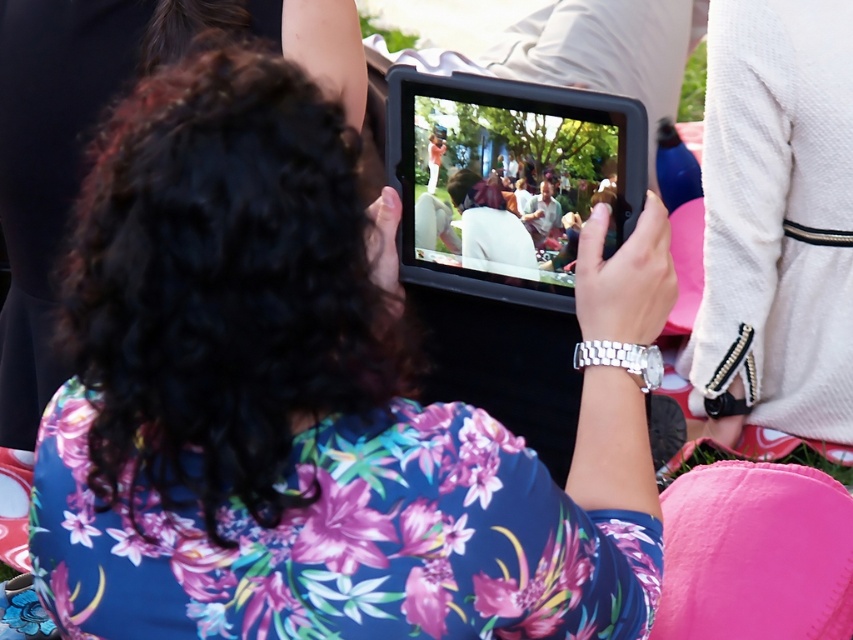
Does floral fabric shirt at center appear on the right side of black matte tablet at center?

In fact, floral fabric shirt at center is to the left of black matte tablet at center.

Is point (125, 337) behind point (416, 237)?

No.

The width and height of the screenshot is (853, 640). What do you see at coordinates (297, 408) in the screenshot?
I see `floral fabric shirt at center` at bounding box center [297, 408].

Find the location of `floral fabric shirt at center`. floral fabric shirt at center is located at coordinates (297, 408).